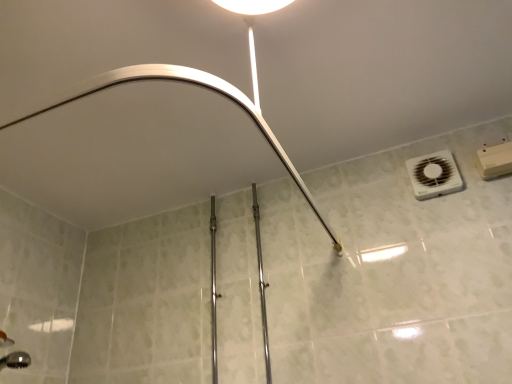
Question: Is polished chrome rail at center positioned beyond the bounds of matte white shower arm at upper center?

Choices:
 (A) no
 (B) yes

Answer: (B)

Question: From a real-world perspective, is polished chrome rail at center under matte white shower arm at upper center?

Choices:
 (A) yes
 (B) no

Answer: (A)

Question: Is polished chrome rail at center wider than matte white shower arm at upper center?

Choices:
 (A) no
 (B) yes

Answer: (A)

Question: Is polished chrome rail at center shorter than matte white shower arm at upper center?

Choices:
 (A) no
 (B) yes

Answer: (A)

Question: From the image's perspective, is polished chrome rail at center above matte white shower arm at upper center?

Choices:
 (A) yes
 (B) no

Answer: (B)

Question: Is polished chrome rail at center smaller than matte white shower arm at upper center?

Choices:
 (A) yes
 (B) no

Answer: (A)

Question: Does white plastic air conditioning at upper right have a greater width compared to polished chrome rail at center?

Choices:
 (A) no
 (B) yes

Answer: (A)

Question: Does white plastic air conditioning at upper right have a lesser height compared to polished chrome rail at center?

Choices:
 (A) no
 (B) yes

Answer: (B)

Question: From a real-world perspective, is white plastic air conditioning at upper right under polished chrome rail at center?

Choices:
 (A) yes
 (B) no

Answer: (B)

Question: Considering the relative positions of white plastic air conditioning at upper right and polished chrome rail at center in the image provided, is white plastic air conditioning at upper right to the left of polished chrome rail at center from the viewer's perspective?

Choices:
 (A) yes
 (B) no

Answer: (B)

Question: From the image's perspective, is white plastic air conditioning at upper right over polished chrome rail at center?

Choices:
 (A) yes
 (B) no

Answer: (A)

Question: Considering the relative positions of white plastic air conditioning at upper right and polished chrome rail at center in the image provided, is white plastic air conditioning at upper right in front of polished chrome rail at center?

Choices:
 (A) yes
 (B) no

Answer: (B)

Question: Considering the relative positions of polished chrome rail at center and white plastic air conditioning at upper right in the image provided, is polished chrome rail at center to the left of white plastic air conditioning at upper right from the viewer's perspective?

Choices:
 (A) no
 (B) yes

Answer: (B)